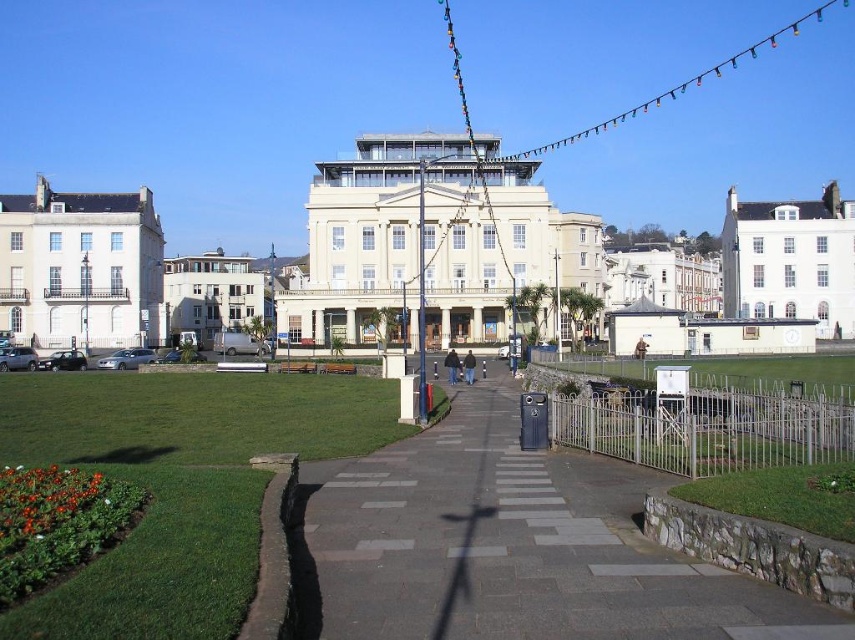
Question: Does silver metallic fence at center-right appear under white painted wood palace at upper right?

Choices:
 (A) no
 (B) yes

Answer: (B)

Question: Is white smooth building at left below white painted wood palace at upper right?

Choices:
 (A) yes
 (B) no

Answer: (A)

Question: Which object is closer to the camera taking this photo?

Choices:
 (A) gray concrete pavement at center
 (B) green grass at lower left
 (C) silver metallic fence at center-right
 (D) white glossy building at center-left

Answer: (B)

Question: Which object appears closest to the camera in this image?

Choices:
 (A) white smooth building at left
 (B) green grass at lower left

Answer: (B)

Question: Is white glossy building at center smaller than white painted wood palace at upper right?

Choices:
 (A) yes
 (B) no

Answer: (B)

Question: Which point appears closest to the camera in this image?

Choices:
 (A) (199, 346)
 (B) (360, 278)
 (C) (128, 310)
 (D) (517, 496)

Answer: (D)